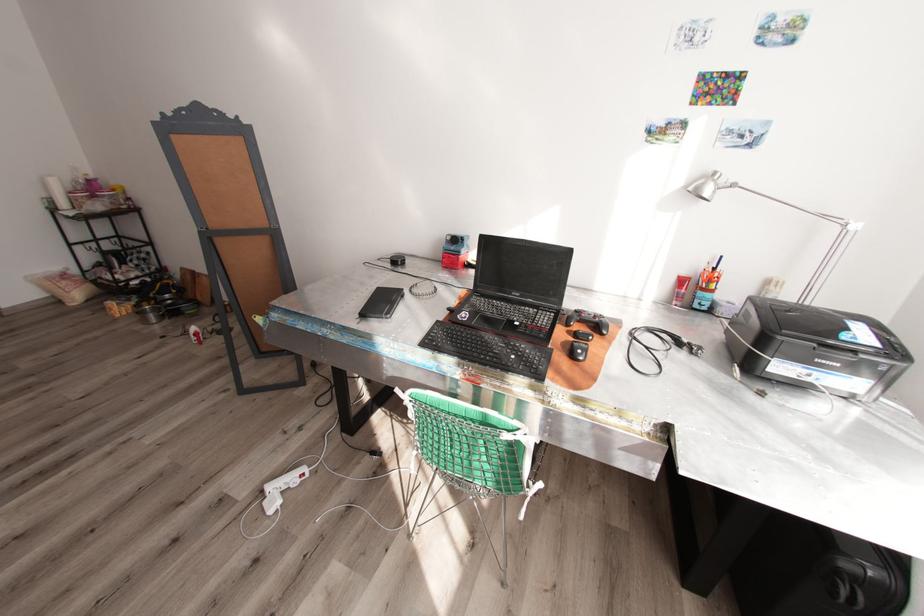
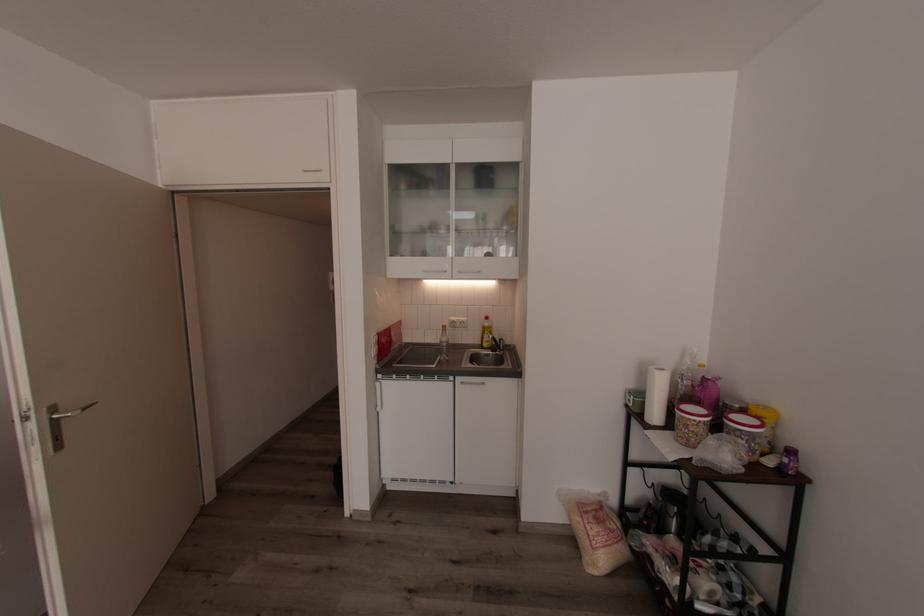
In the second image, find the point that corresponds to [68,204] in the first image.

(660, 415)